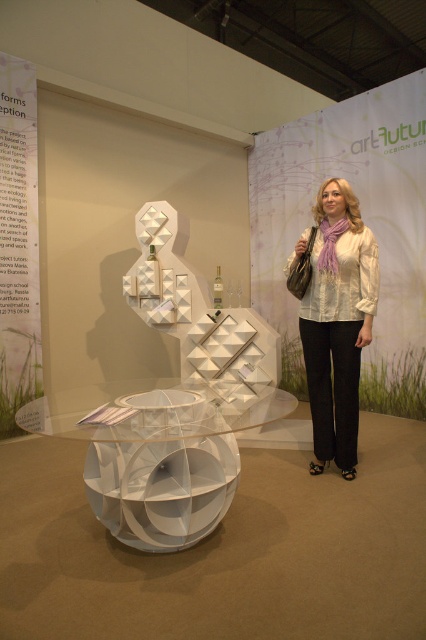
You are an interior designer arranging items in the exhibition space. You have a white matte sculpture at center and a white sheer blouse at center. Which item should you place higher to maintain the display theme?

The white matte sculpture at center should be placed higher than the white sheer blouse at center to maintain the display theme, as the white matte sculpture at center is located above white sheer blouse at center according to the description.

You are an interior designer assessing the layout of the exhibition space. You notice the white matte sculpture at center and the white sheer blouse at center. Based on their widths, which object would require more horizontal space to accommodate on a shelf?

The white matte sculpture at center requires more horizontal space because its width surpasses that of the white sheer blouse at center.

You are an interior designer who wants to place a new decorative item between the white matte sculpture at center and the white sheer blouse at center. What is the minimum distance you need to maintain between these two items to ensure the new item fits comfortably?

The minimum distance needed to place a new decorative item between the white matte sculpture at center and the white sheer blouse at center is 32.91 inches, as this is the current spacing between them.